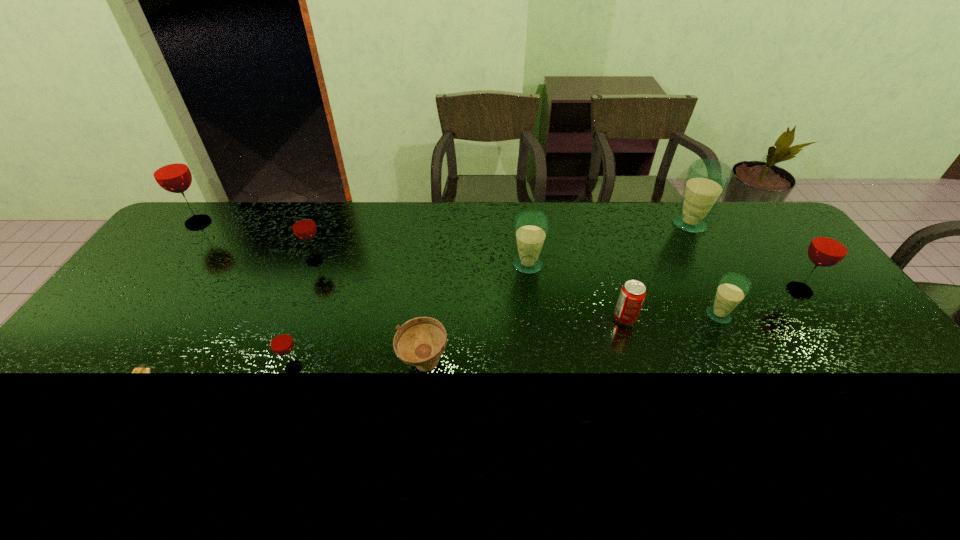
You are a GUI agent. You are given a task and a screenshot of the screen. Output one action in this format:
    pyautogui.click(x=<x>, y=<y>)
    Task: Click on the free space in the image that satisfies the following two spatial constraints: 1. on the front side of the sixth nearest object; 2. on the right side of the biggest blue glass
    
    Given the screenshot: What is the action you would take?
    pyautogui.click(x=727, y=291)